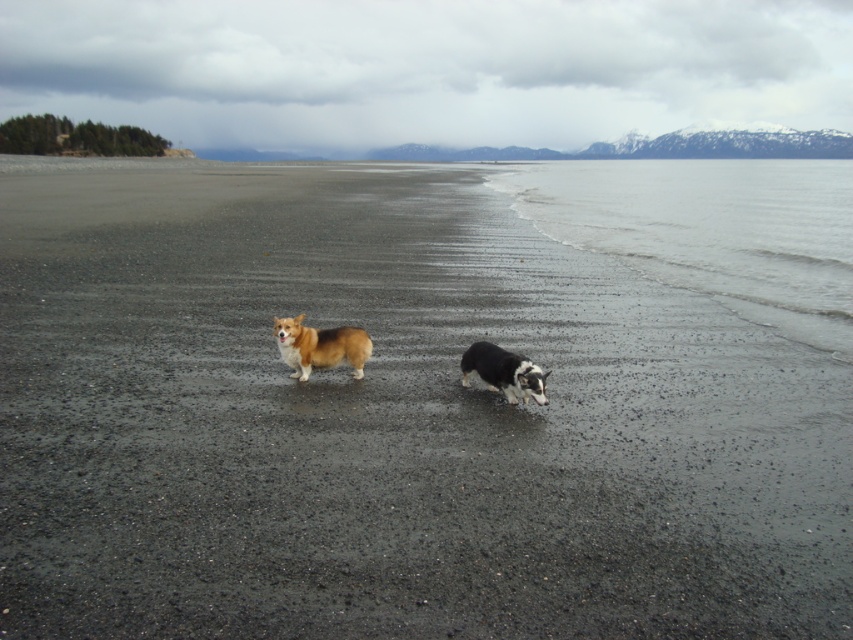
Where is `clear water at lower right`? Image resolution: width=853 pixels, height=640 pixels. clear water at lower right is located at coordinates (712, 230).

Consider the image. Is clear water at lower right thinner than brown plush corgi at center?

No, clear water at lower right is not thinner than brown plush corgi at center.

This screenshot has width=853, height=640. Describe the element at coordinates (712, 230) in the screenshot. I see `clear water at lower right` at that location.

Locate an element on the screen. Image resolution: width=853 pixels, height=640 pixels. clear water at lower right is located at coordinates (712, 230).

Is clear water at lower right thinner than black and white fur dog at center?

In fact, clear water at lower right might be wider than black and white fur dog at center.

Between point (689, 208) and point (505, 356), which one is positioned in front?

Point (505, 356)

Is point (693, 264) behind point (497, 378)?

Yes, point (693, 264) is behind point (497, 378).

Identify the location of clear water at lower right. This screenshot has height=640, width=853. (712, 230).

Can you confirm if brown plush corgi at center is positioned to the right of black and white fur dog at center?

In fact, brown plush corgi at center is to the left of black and white fur dog at center.

In the scene shown: Does brown plush corgi at center have a greater width compared to black and white fur dog at center?

Correct, the width of brown plush corgi at center exceeds that of black and white fur dog at center.

Is point (344, 332) farther from camera compared to point (523, 396)?

Yes, point (344, 332) is farther from viewer.

Where is `brown plush corgi at center`? Image resolution: width=853 pixels, height=640 pixels. brown plush corgi at center is located at coordinates (318, 346).